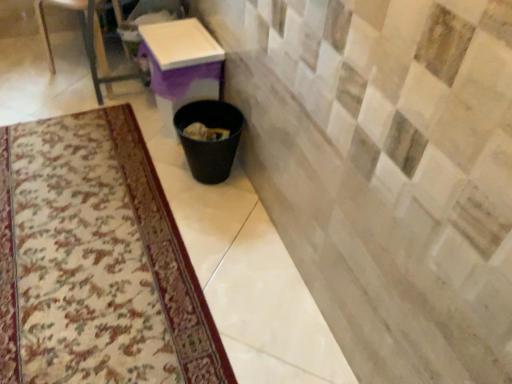
Question: Is white glossy table at center bigger or smaller than black plastic trash can at lower center?

Choices:
 (A) big
 (B) small

Answer: (A)

Question: From a real-world perspective, is white glossy table at center positioned above or below black plastic trash can at lower center?

Choices:
 (A) above
 (B) below

Answer: (A)

Question: Based on their relative distances, which object is farther from the white glossy table at center?

Choices:
 (A) metallic glass table at upper left
 (B) black plastic trash can at lower center
 (C) carpeted mat at lower left

Answer: (C)

Question: Estimate the real-world distances between objects in this image. Which object is closer to the white glossy table at center?

Choices:
 (A) carpeted mat at lower left
 (B) metallic glass table at upper left
 (C) black plastic trash can at lower center

Answer: (C)